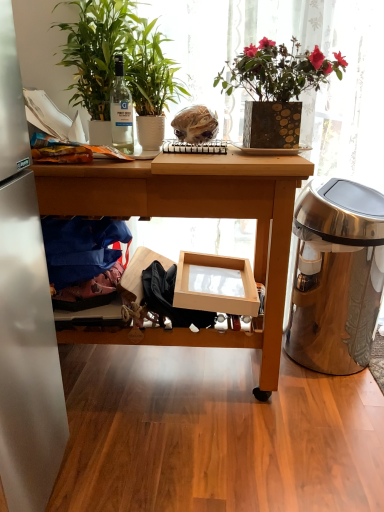
In order to face translucent plastic bag at center, should I rotate leftwards or rightwards?

To align with it, rotate right about 0.376°.

Measure the distance between point (x=218, y=186) and camera.

Point (x=218, y=186) and camera are 1.27 meters apart from each other.

Where is `green glossy plant at upper left, which is the second houseplant in left-to-right order`? The height and width of the screenshot is (512, 384). green glossy plant at upper left, which is the second houseplant in left-to-right order is located at coordinates (151, 84).

What do you see at coordinates (337, 276) in the screenshot? The image size is (384, 512). I see `stainless steel trash can at right` at bounding box center [337, 276].

In order to click on blue fabric at left in this screenshot , I will do `click(81, 247)`.

Identify the location of green matte plant at left, the second houseplant viewed from the right. The width and height of the screenshot is (384, 512). (119, 56).

What are the coordinates of `clear glass bottle at upper left` in the screenshot? It's located at (121, 111).

Locate an element on the screen. This screenshot has width=384, height=512. translucent plastic bag at center is located at coordinates (195, 124).

Can you confirm if white matte plate at center is positioned to the left of wooden desk at center?

No.

Identify the location of desk that is under the white matte plate at center (from a real-world perspective). (193, 217).

Can you see white matte plate at center touching wooden desk at center?

No, white matte plate at center is not beside wooden desk at center.

Which object is further away from the camera taking this photo, white matte plate at center or wooden desk at center?

white matte plate at center.

From a real-world perspective, is stainless steel trash can at right physically located above or below clear glass bottle at upper left?

stainless steel trash can at right is situated lower than clear glass bottle at upper left in the real world.

Does stainless steel trash can at right have a lesser height compared to clear glass bottle at upper left?

No.

Between stainless steel trash can at right and clear glass bottle at upper left, which one is positioned behind?

stainless steel trash can at right is further away from the camera.

Based on their sizes in the image, would you say stainless steel trash can at right is bigger or smaller than clear glass bottle at upper left?

Considering their sizes, stainless steel trash can at right takes up more space than clear glass bottle at upper left.

From the image's perspective, is blue fabric at left beneath green matte plant at left, which ranks as the 1th houseplant in left-to-right order?

Yes.

Is blue fabric at left facing away from green matte plant at left, which ranks as the 1th houseplant in left-to-right order?

No, blue fabric at left's orientation is not away from green matte plant at left, which ranks as the 1th houseplant in left-to-right order.

Is blue fabric at left touching green matte plant at left, which ranks as the 1th houseplant in left-to-right order?

They are not placed beside each other.

Who is taller, blue fabric at left or green matte plant at left, the second houseplant viewed from the right?

green matte plant at left, the second houseplant viewed from the right, is taller.

From a real-world perspective, is clear glass bottle at upper left positioned above or below white matte plate at center?

clear glass bottle at upper left is above white matte plate at center.

Are clear glass bottle at upper left and white matte plate at center making contact?

They are not placed beside each other.

Which is correct: clear glass bottle at upper left is inside white matte plate at center, or outside of it?

clear glass bottle at upper left lies outside white matte plate at center.

Considering the sizes of clear glass bottle at upper left and white matte plate at center in the image, is clear glass bottle at upper left taller or shorter than white matte plate at center?

Considering their sizes, clear glass bottle at upper left has more height than white matte plate at center.

Considering the relative sizes of white matte plate at center and translucent plastic bag at center in the image provided, is white matte plate at center shorter than translucent plastic bag at center?

Indeed, white matte plate at center has a lesser height compared to translucent plastic bag at center.

Which is more to the left, white matte plate at center or translucent plastic bag at center?

translucent plastic bag at center.

Considering the relative sizes of white matte plate at center and translucent plastic bag at center in the image provided, is white matte plate at center smaller than translucent plastic bag at center?

Correct, white matte plate at center occupies less space than translucent plastic bag at center.

Between white matte plate at center and translucent plastic bag at center, which one has smaller width?

white matte plate at center is thinner.

Is white matte plate at center bigger than green matte plant at left, which ranks as the 1th houseplant in left-to-right order?

Incorrect, white matte plate at center is not larger than green matte plant at left, which ranks as the 1th houseplant in left-to-right order.

Who is taller, white matte plate at center or green matte plant at left, which ranks as the 1th houseplant in left-to-right order?

green matte plant at left, which ranks as the 1th houseplant in left-to-right order.

Can you confirm if white matte plate at center is positioned to the left of green matte plant at left, which ranks as the 1th houseplant in left-to-right order?

No.

This screenshot has width=384, height=512. What are the coordinates of `plate directly beneath the green matte plant at left, the second houseplant viewed from the right (from a real-world perspective)` in the screenshot? It's located at (272, 150).

Is point (124, 114) positioned in front of point (131, 49)?

That is False.

Considering the positions of objects clear glass bottle at upper left and green glossy plant at upper left, which is the second houseplant in left-to-right order, in the image provided, who is more to the left, clear glass bottle at upper left or green glossy plant at upper left, which is the second houseplant in left-to-right order,?

Positioned to the left is clear glass bottle at upper left.

Is green glossy plant at upper left, the 1th houseplant in the right-to-left sequence, inside clear glass bottle at upper left?

No, green glossy plant at upper left, the 1th houseplant in the right-to-left sequence, is not surrounded by clear glass bottle at upper left.

Consider the image. From the image's perspective, relative to green glossy plant at upper left, the 1th houseplant in the right-to-left sequence, is clear glass bottle at upper left above or below?

clear glass bottle at upper left is below green glossy plant at upper left, the 1th houseplant in the right-to-left sequence.

You are a GUI agent. You are given a task and a screenshot of the screen. Output one action in this format:
    pyautogui.click(x=<x>, y=<y>)
    Task: Click on the desk below the white matte plate at center (from a real-world perspective)
    The width and height of the screenshot is (384, 512).
    Given the screenshot: What is the action you would take?
    pyautogui.click(x=193, y=217)

The height and width of the screenshot is (512, 384). In order to click on bottle above the stainless steel trash can at right (from the image's perspective) in this screenshot , I will do `click(121, 111)`.

From the image, which object appears to be farther from green matte plant at left, the second houseplant viewed from the right, wooden desk at center or blue fabric at left?

blue fabric at left is further to green matte plant at left, the second houseplant viewed from the right.

From the image, which object appears to be farther from wooden desk at center, green matte plant at left, the second houseplant viewed from the right, or stainless steel trash can at right?

green matte plant at left, the second houseplant viewed from the right, is further to wooden desk at center.

Estimate the real-world distances between objects in this image. Which object is closer to translucent plastic bag at center, clear glass bottle at upper left or white matte plate at center?

clear glass bottle at upper left.

Estimate the real-world distances between objects in this image. Which object is further from green glossy plant at upper left, which is the second houseplant in left-to-right order, blue fabric at left or stainless steel trash can at right?

The object further to green glossy plant at upper left, which is the second houseplant in left-to-right order, is stainless steel trash can at right.

Which object lies further to the anchor point translucent plastic bag at center, blue fabric at left or wooden desk at center?

blue fabric at left lies further to translucent plastic bag at center than the other object.

Estimate the real-world distances between objects in this image. Which object is closer to clear glass bottle at upper left, stainless steel trash can at right or green glossy plant at upper left, the 1th houseplant in the right-to-left sequence?

The object closer to clear glass bottle at upper left is green glossy plant at upper left, the 1th houseplant in the right-to-left sequence.

From the picture: Which object lies nearer to the anchor point clear glass bottle at upper left, green glossy plant at upper left, which is the second houseplant in left-to-right order, or stainless steel trash can at right?

green glossy plant at upper left, which is the second houseplant in left-to-right order.

From the image, which object appears to be nearer to white matte plate at center, stainless steel trash can at right or green matte plant at left, the second houseplant viewed from the right?

The object closer to white matte plate at center is green matte plant at left, the second houseplant viewed from the right.

Image resolution: width=384 pixels, height=512 pixels. Find the location of `houseplant located between clear glass bottle at upper left and white matte plate at center in the left-right direction`. houseplant located between clear glass bottle at upper left and white matte plate at center in the left-right direction is located at coordinates (151, 84).

Identify the location of plate that lies between green glossy plant at upper left, which is the second houseplant in left-to-right order, and wooden desk at center from top to bottom. (272, 150).

Locate an element on the screen. desk located between clear glass bottle at upper left and stainless steel trash can at right in the left-right direction is located at coordinates (193, 217).

I want to click on bottle between green glossy plant at upper left, which is the second houseplant in left-to-right order, and blue fabric at left, in the vertical direction, so click(x=121, y=111).